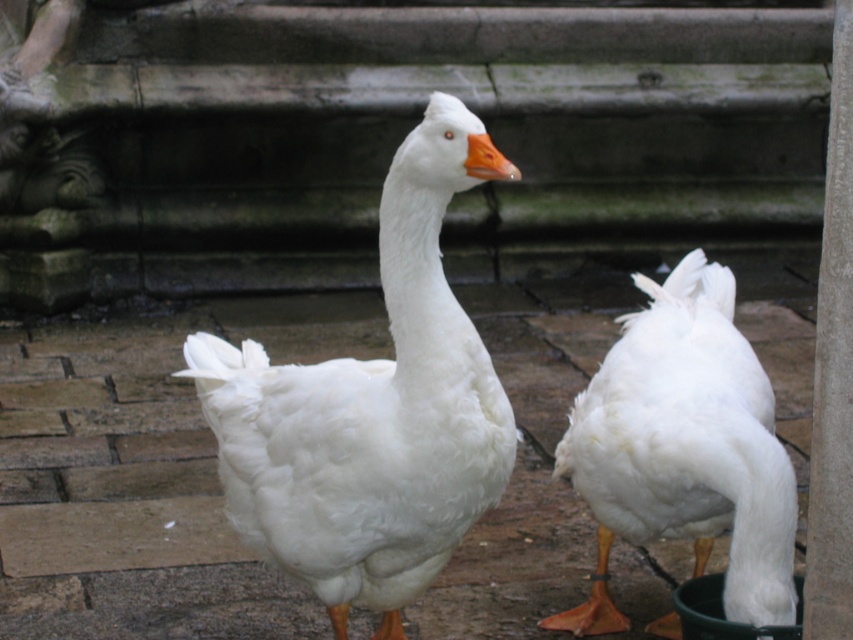
Who is lower down, white fluffy goose at center or white fluffy duck at lower right?

white fluffy duck at lower right is lower down.

Can you confirm if white fluffy goose at center is shorter than white fluffy duck at lower right?

No, white fluffy goose at center is not shorter than white fluffy duck at lower right.

Is point (238, 444) positioned behind point (793, 612)?

No.

The width and height of the screenshot is (853, 640). What are the coordinates of `white fluffy goose at center` in the screenshot? It's located at (372, 410).